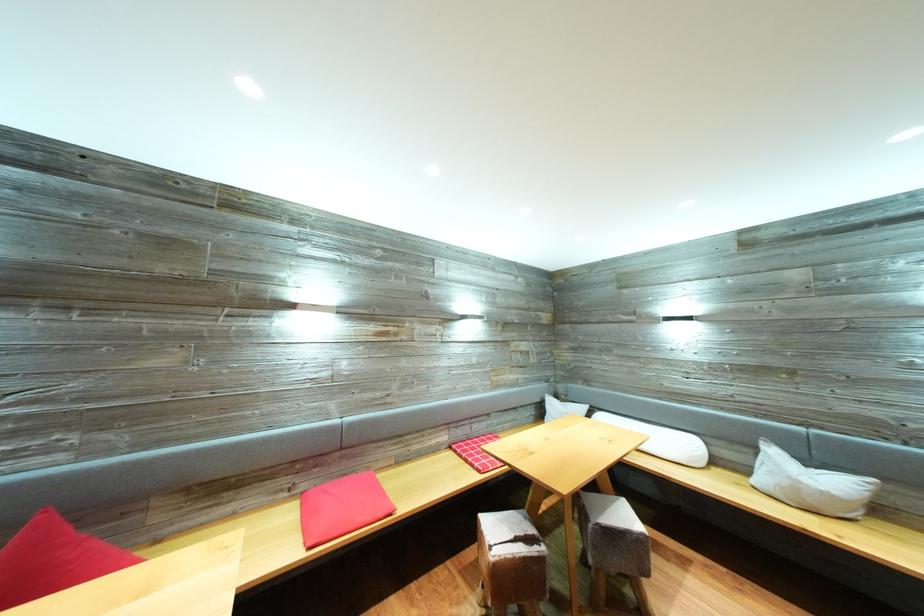
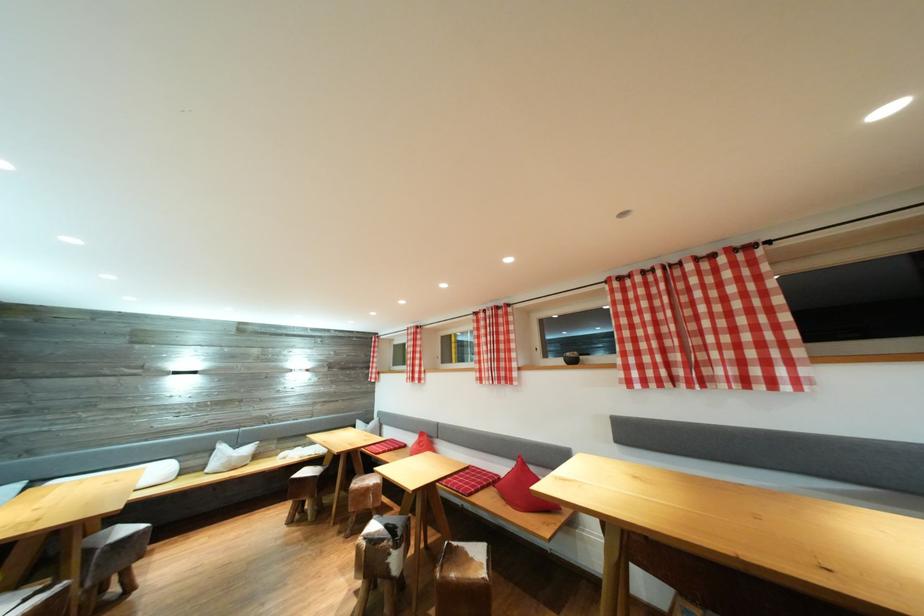
The point at (677, 456) is marked in the first image. Where is the corresponding point in the second image?

(161, 483)